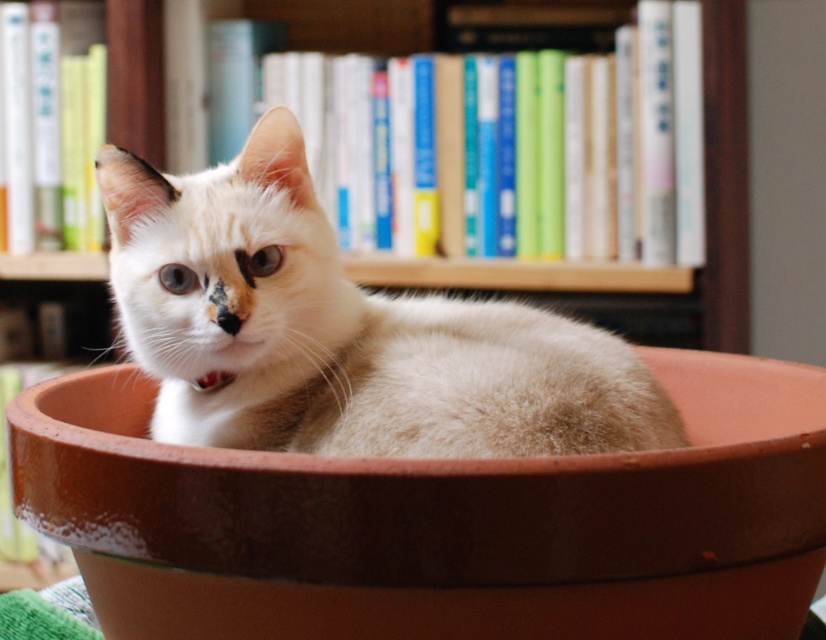
Is terracotta clay bowl at center closer to camera compared to soft white fur cat at center?

Yes, it is in front of soft white fur cat at center.

Is terracotta clay bowl at center thinner than soft white fur cat at center?

No.

Between point (12, 438) and point (133, 284), which one is positioned in front?

Point (12, 438)

Identify the location of terracotta clay bowl at center. This screenshot has height=640, width=826. (439, 522).